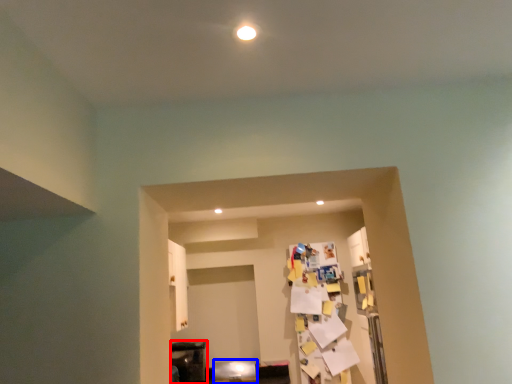
Question: Which point is further to the camera, furniture (highlighted by a red box) or furniture (highlighted by a blue box)?

Choices:
 (A) furniture
 (B) furniture

Answer: (A)